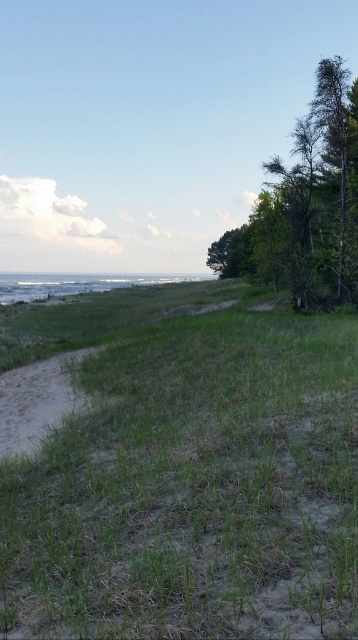
Question: Among these points, which one is nearest to the camera?

Choices:
 (A) (210, 416)
 (B) (2, 448)

Answer: (A)

Question: Considering the real-world distances, which object is farthest from the green grassy at lower left?

Choices:
 (A) sandy dirt path at lower left
 (B) dark green leafy tree at right

Answer: (B)

Question: Is green grassy at lower left smaller than dark green leafy tree at right?

Choices:
 (A) yes
 (B) no

Answer: (A)

Question: Which of these objects is positioned closest to the dark green leafy tree at right?

Choices:
 (A) sandy dirt path at lower left
 (B) green grassy at lower left

Answer: (B)

Question: Observing the image, what is the correct spatial positioning of dark green leafy tree at right in reference to sandy dirt path at lower left?

Choices:
 (A) left
 (B) right

Answer: (B)

Question: Does green grassy at lower left have a greater width compared to dark green leafy tree at right?

Choices:
 (A) no
 (B) yes

Answer: (B)